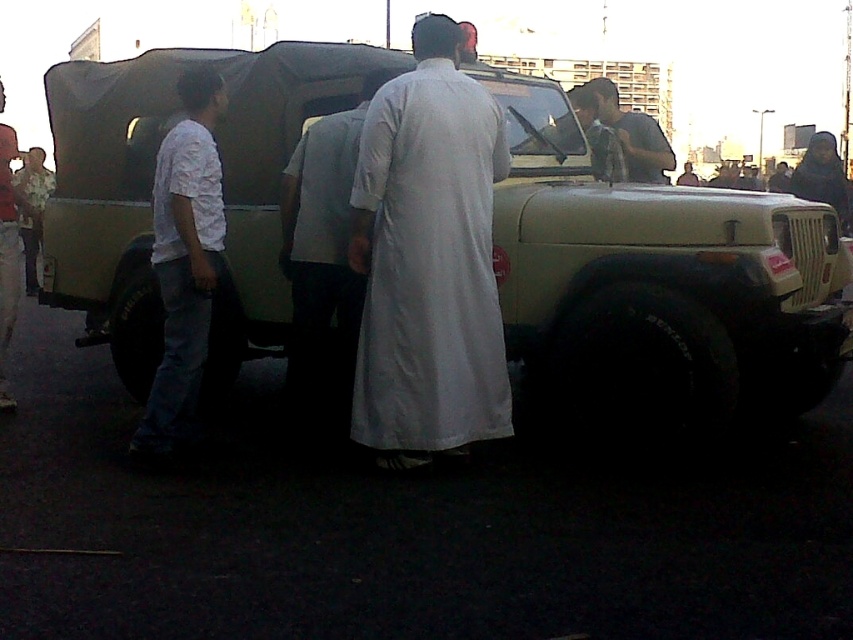
You are a photographer trying to capture a group photo of the matte khaki jeep at center and the white cotton shirt at left. Since you want to include both subjects in the frame, which subject should you position closer to the camera to ensure both are visible without cropping?

The matte khaki jeep at center is positioned on the right side of white cotton shirt at left. To include both subjects in the frame without cropping, you should position the white cotton shirt at left closer to the camera since it is currently on the left side and further away from the jeep.

You are organizing a costume party and need to choose between the white cotton robe at center and the white matte robe at center based on their sizes. Which robe should you pick if you want the wider option?

The white cotton robe at center has a larger width than the white matte robe at center, so you should choose the white cotton robe at center for the wider option.

A person wearing a white cotton robe at center is standing near a Jeep. If the person wants to hand an item to someone standing 12.91 feet away, will they need to move closer to do so?

The distance between the person in the white cotton robe at center and the other individual is 12.91 feet. Since this distance is greater than the typical comfortable reaching distance of about 3 feet, the person would need to move closer to hand the item effectively.